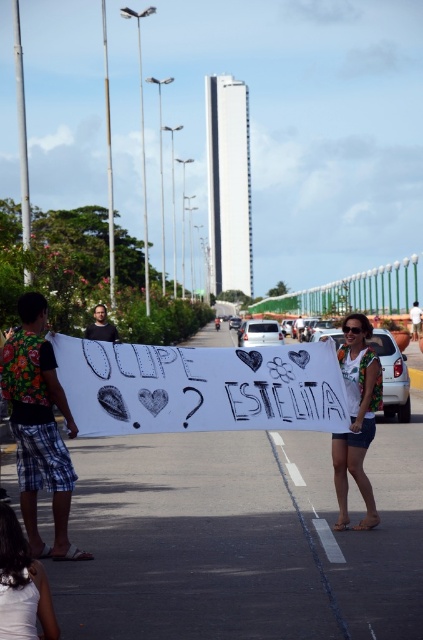
Can you confirm if white fabric sign at center is positioned to the right of white fabric at lower left?

Correct, you'll find white fabric sign at center to the right of white fabric at lower left.

Does point (337, 467) come closer to viewer compared to point (49, 608)?

No, it is behind (49, 608).

At what (x,y) coordinates should I click in order to perform the action: click on white fabric sign at center. Please return your answer as a coordinate pair (x, y). The image size is (423, 640). Looking at the image, I should click on (357, 417).